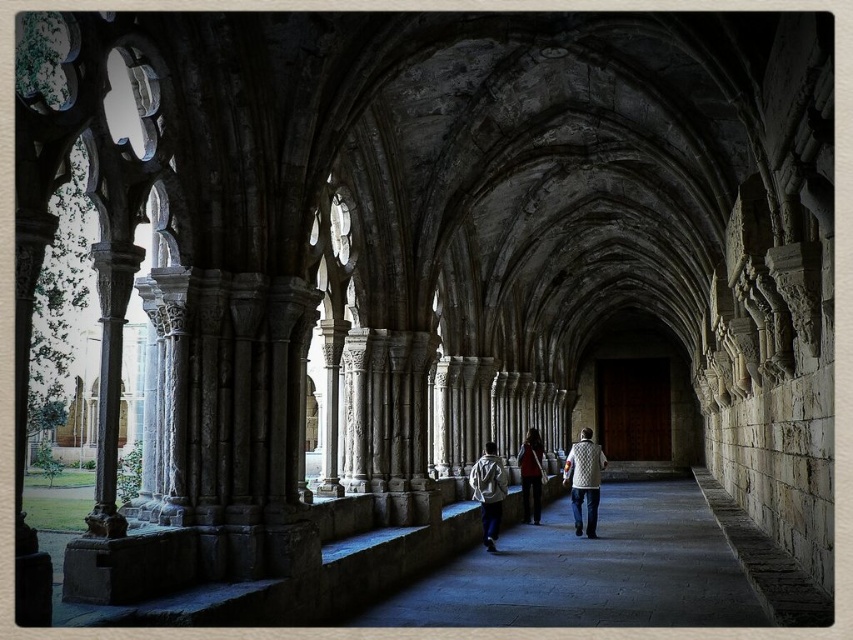
Question: Which object is positioned closest to the white knitted vest at center?

Choices:
 (A) dark stone path at center
 (B) white fabric jacket at center
 (C) matte red sweater at center

Answer: (C)

Question: Is white knitted vest at center bigger than white fabric jacket at center?

Choices:
 (A) no
 (B) yes

Answer: (B)

Question: Which point appears farthest from the camera in this image?

Choices:
 (A) (514, 612)
 (B) (485, 484)

Answer: (B)

Question: Which object is closer to the camera taking this photo?

Choices:
 (A) white knitted vest at center
 (B) matte red sweater at center

Answer: (A)

Question: Considering the relative positions of dark stone path at center and white knitted vest at center in the image provided, where is dark stone path at center located with respect to white knitted vest at center?

Choices:
 (A) right
 (B) left

Answer: (B)

Question: Can you confirm if white knitted vest at center is positioned below matte red sweater at center?

Choices:
 (A) yes
 (B) no

Answer: (A)